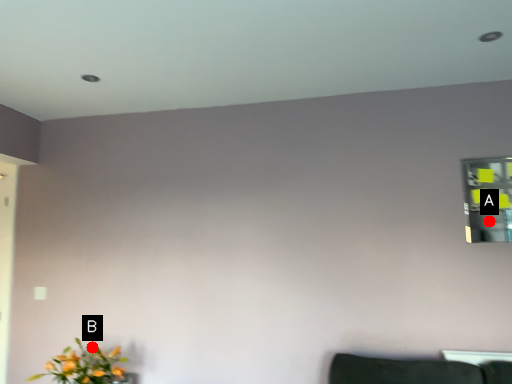
Question: Two points are circled on the image, labeled by A and B beside each circle. Which point appears closest to the camera in this image?

Choices:
 (A) A is closer
 (B) B is closer

Answer: (A)